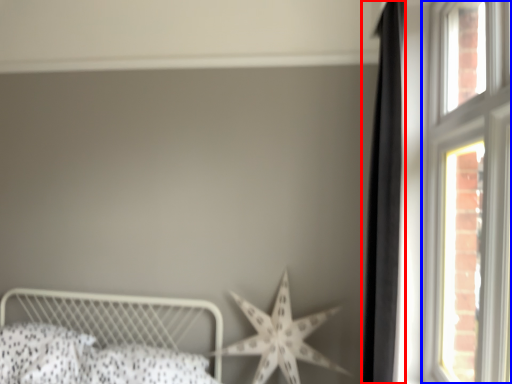
Question: Which of the following is the closest to the observer, curtain (highlighted by a red box) or window (highlighted by a blue box)?

Choices:
 (A) curtain
 (B) window

Answer: (B)